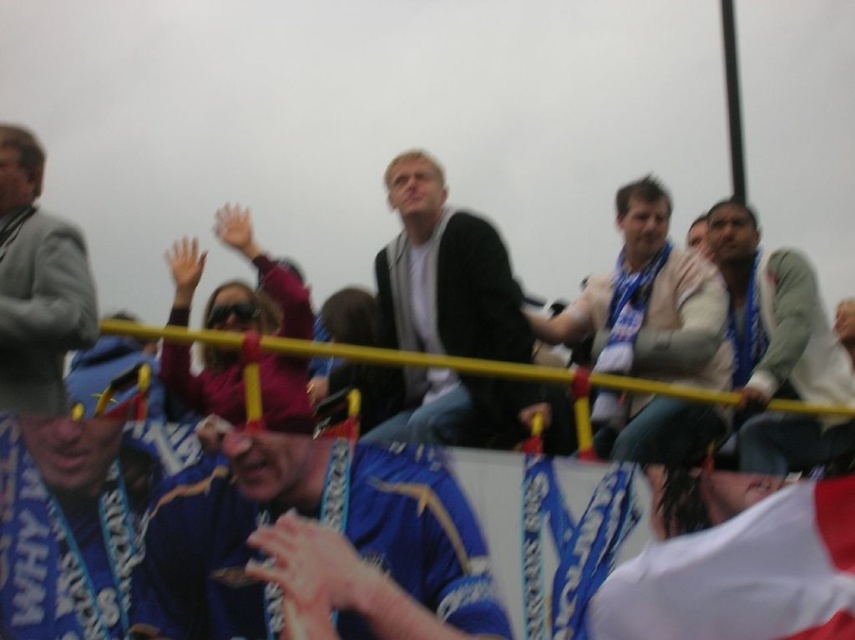
Question: Can you confirm if matte black jacket at center is wider than white scarf at center?

Choices:
 (A) yes
 (B) no

Answer: (B)

Question: Among these objects, which one is nearest to the camera?

Choices:
 (A) maroon fleece jacket at center
 (B) light gray sweater at upper right

Answer: (A)

Question: Which is farther from the light gray sweater at upper right?

Choices:
 (A) matte black jacket at center
 (B) light gray suit at left
 (C) maroon fleece jacket at center
 (D) white scarf at center

Answer: (B)

Question: Estimate the real-world distances between objects in this image. Which object is farther from the matte black jacket at center?

Choices:
 (A) light gray sweater at upper right
 (B) maroon fleece jacket at center

Answer: (A)

Question: In this image, where is matte black jacket at center located relative to light gray suit at left?

Choices:
 (A) left
 (B) right

Answer: (B)

Question: Is blue jersey at center smaller than light gray sweater at upper right?

Choices:
 (A) yes
 (B) no

Answer: (A)